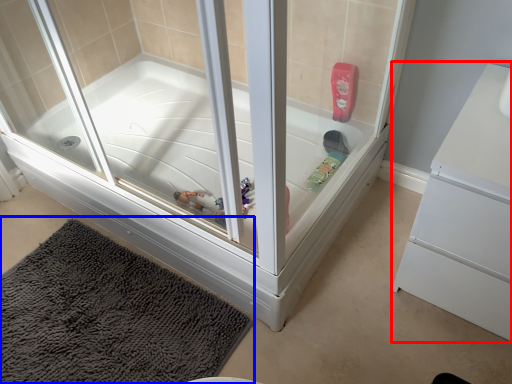
Question: Among these objects, which one is nearest to the camera, dresser (highlighted by a red box) or bath mat (highlighted by a blue box)?

Choices:
 (A) dresser
 (B) bath mat

Answer: (A)